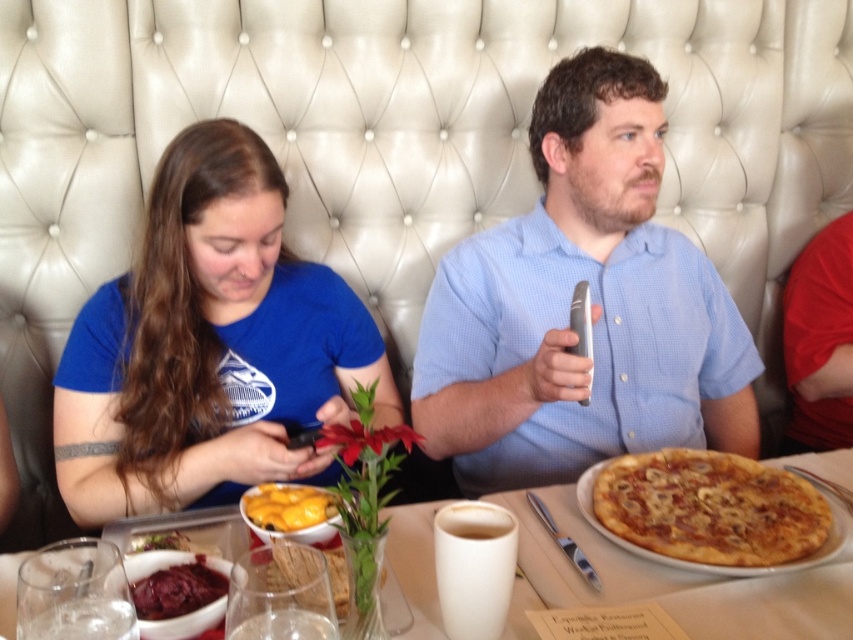
Question: Does blue cotton shirt at upper left lie behind smooth brown bread at lower left?

Choices:
 (A) no
 (B) yes

Answer: (B)

Question: Among these objects, which one is farthest from the camera?

Choices:
 (A) blue cotton shirt at upper left
 (B) white ceramic mug at center

Answer: (A)

Question: Which of the following is the closest to the observer?

Choices:
 (A) (91, 497)
 (B) (744, 634)
 (C) (132, 547)

Answer: (B)

Question: Which object appears closest to the camera in this image?

Choices:
 (A) blue cotton shirt at upper left
 (B) white ceramic mug at center
 (C) smooth brown bread at lower left

Answer: (B)

Question: Does blue cotton shirt at upper left have a lesser width compared to smooth dark red jam at lower left?

Choices:
 (A) yes
 (B) no

Answer: (B)

Question: Does white ceramic mug at center have a smaller size compared to smooth brown bread at lower left?

Choices:
 (A) no
 (B) yes

Answer: (A)